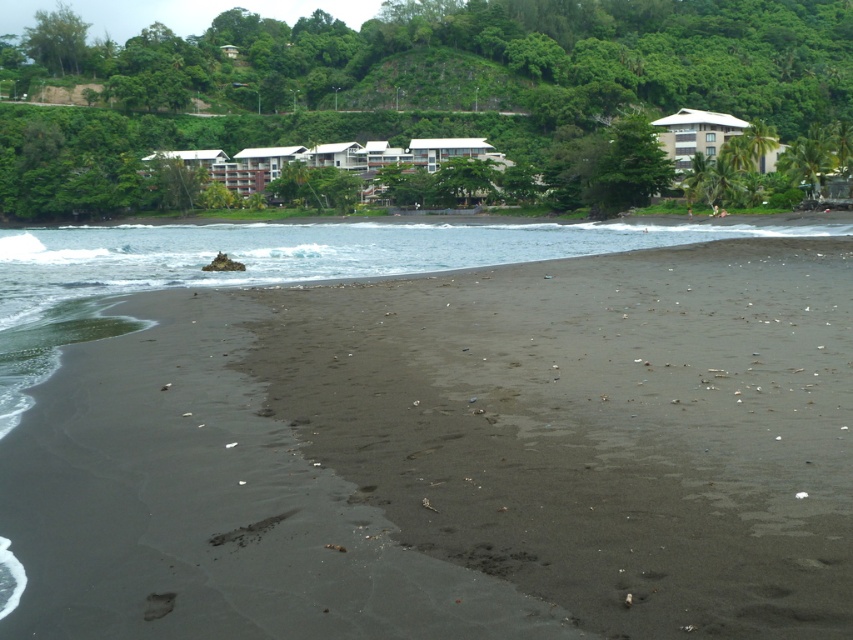
Question: Does dark sand at center appear over white matte building at center?

Choices:
 (A) yes
 (B) no

Answer: (B)

Question: Which object appears farthest from the camera in this image?

Choices:
 (A) dark sand at center
 (B) white matte building at center

Answer: (B)

Question: Is dark sand at center positioned before white matte building at center?

Choices:
 (A) yes
 (B) no

Answer: (A)

Question: Is dark sand at center positioned at the back of white matte building at center?

Choices:
 (A) no
 (B) yes

Answer: (A)

Question: Which of the following is the farthest from the observer?

Choices:
 (A) dark sand at center
 (B) white matte building at center

Answer: (B)